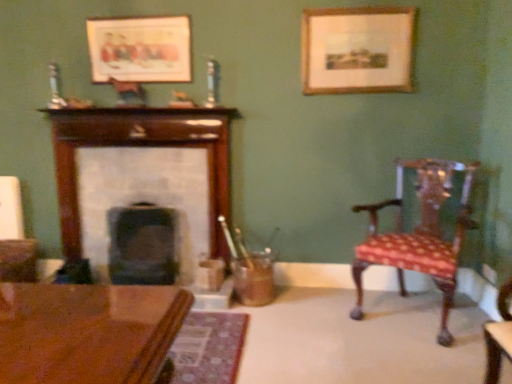
Locate an element on the screen. The image size is (512, 384). vacant space in front of polished wood chair at right is located at coordinates (410, 361).